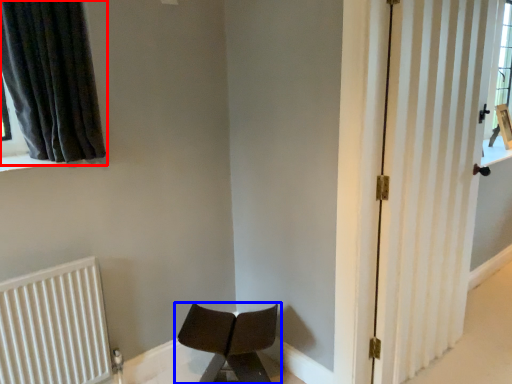
Question: Which of the following is the farthest to the observer, curtain (highlighted by a red box) or chair (highlighted by a blue box)?

Choices:
 (A) curtain
 (B) chair

Answer: (B)